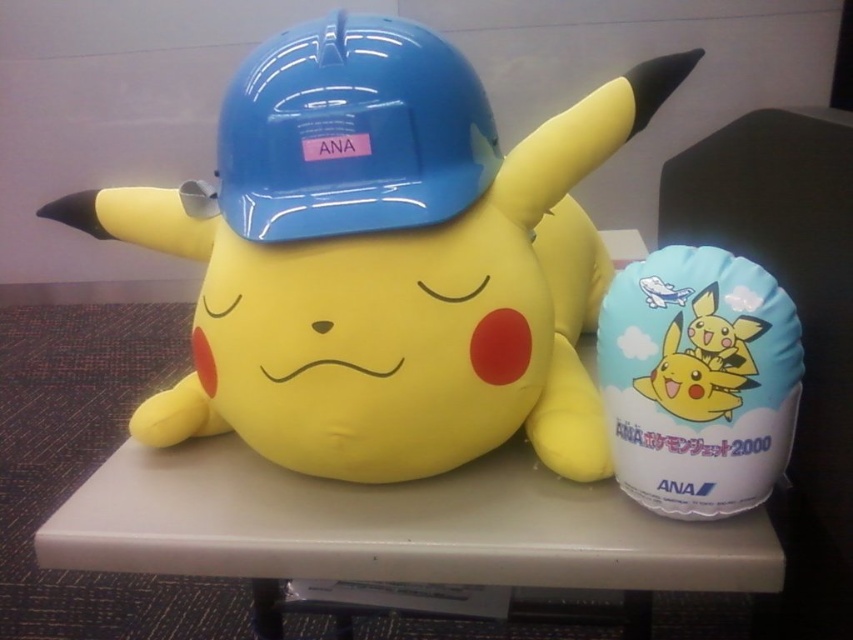
You are organizing a birthday party and have placed a white matte table at center and a white fabric balloon at right. Which object has a greater width?

The white matte table at center has a greater width than the white fabric balloon at right.

You are standing at the origin point in the image. Which of the two points, point (x=619, y=76) or point (x=546, y=577), is farther away from you?

Point (x=619, y=76) is behind point (x=546, y=577), so it is farther away from you.